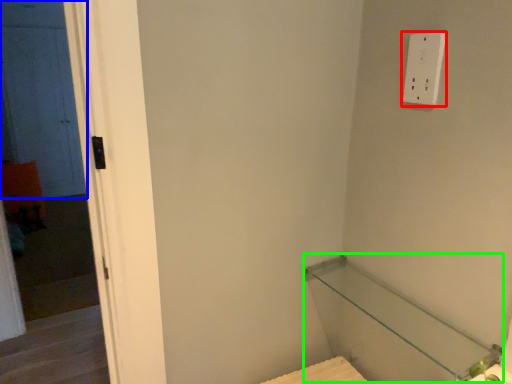
Question: Estimate the real-world distances between objects in this image. Which object is farther from light switch (highlighted by a red box), door (highlighted by a blue box) or balustrade (highlighted by a green box)?

Choices:
 (A) door
 (B) balustrade

Answer: (A)